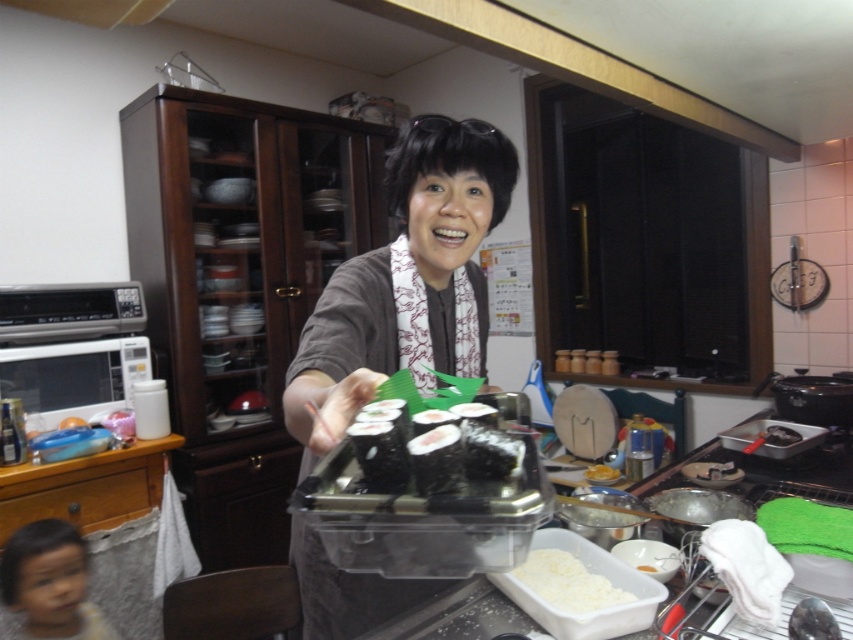
You are a food critic evaluating the presentation of the sushi rolls. Based on the image, which of the two components, the black seaweed sushi at center or the white fluffy rice at lower center, is more prominent in size?

The white fluffy rice at lower center is more prominent in size since it is larger than the black seaweed sushi at center.

You are a chef who needs to place a 12 inch long spatula between the matte gray sweater at center and the white fluffy rice at lower center. Is there enough space for the spatula to fit between them?

The distance between the matte gray sweater at center and the white fluffy rice at lower center is 16.43 inches. Since the spatula is 12 inches long, there is sufficient space for it to fit between them.

You are a chef preparing a sushi platter. You need to place a new sushi roll exactly at the center of the white fluffy rice at lower center. What are the coordinates where you should place it?

The coordinates for the center of the white fluffy rice at lower center are at point (567, 582). So you should place the sushi roll at those coordinates.